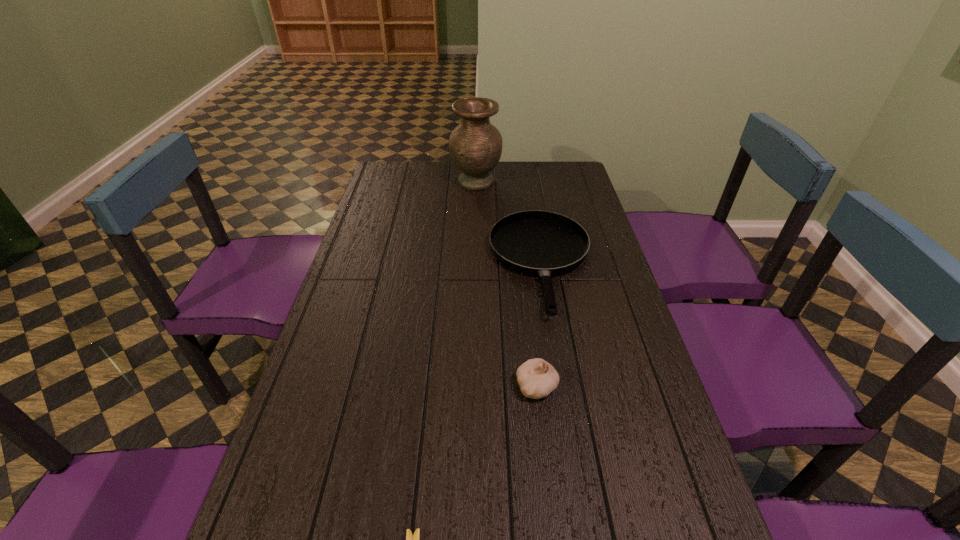
Select which object is the third closest to the nearest object. Please provide its 2D coordinates. Your answer should be formatted as a tuple, i.e. [(x, y)], where the tuple contains the x and y coordinates of a point satisfying the conditions above.

[(475, 145)]

The height and width of the screenshot is (540, 960). Find the location of `vacant area in the image that satisfies the following two spatial constraints: 1. on the front side of the vase; 2. on the left side of the garlic`. vacant area in the image that satisfies the following two spatial constraints: 1. on the front side of the vase; 2. on the left side of the garlic is located at coordinates (473, 386).